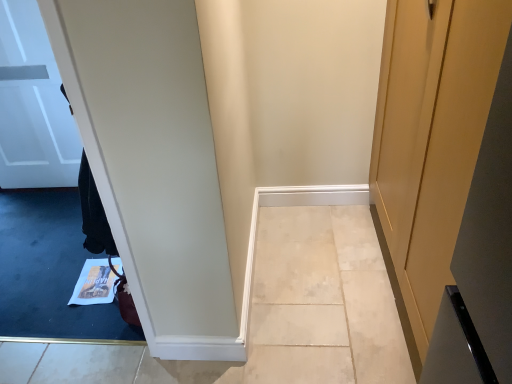
You are a GUI agent. You are given a task and a screenshot of the screen. Output one action in this format:
    pyautogui.click(x=<x>, y=<y>)
    Task: Click on the white painted wood door at left
    
    Given the screenshot: What is the action you would take?
    pyautogui.click(x=33, y=105)

What do you see at coordinates (33, 105) in the screenshot? The image size is (512, 384). I see `white painted wood door at left` at bounding box center [33, 105].

What are the coordinates of `white painted wood door at left` in the screenshot? It's located at (33, 105).